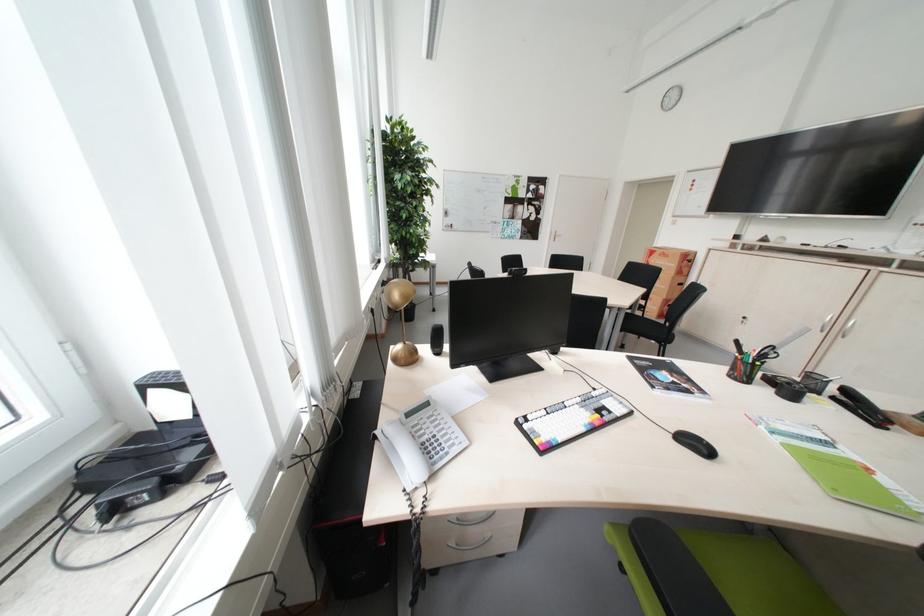
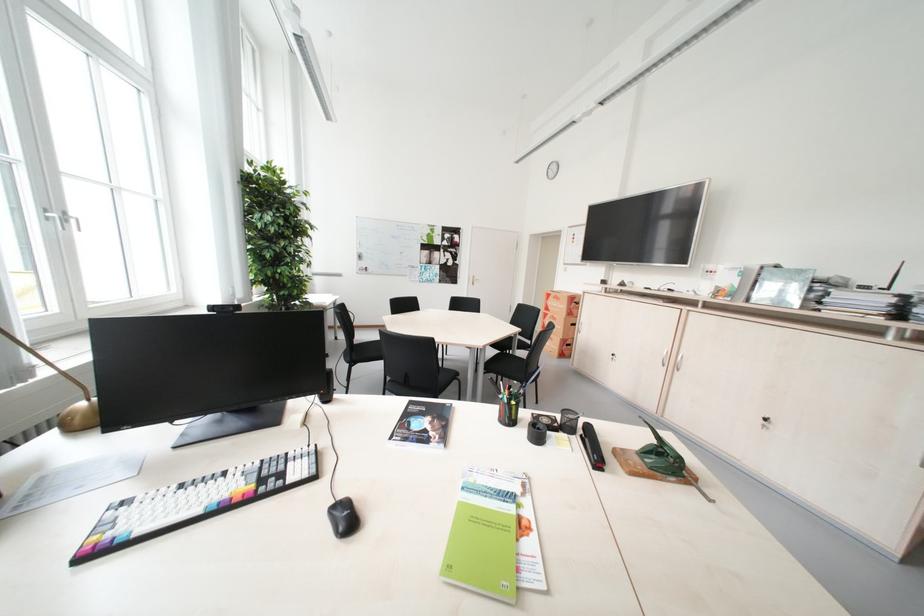
In the second image, find the point that corresponds to (x=665, y=256) in the first image.

(561, 299)